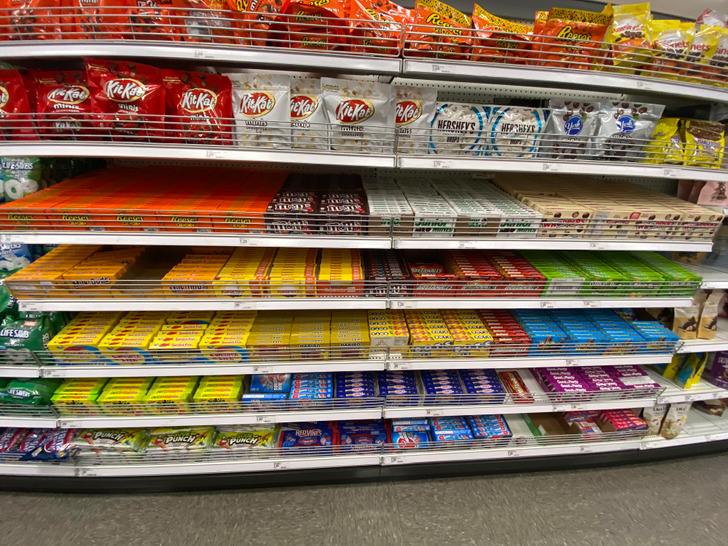
Find the location of a particular element. gray and white marble like floor is located at coordinates (373, 521).